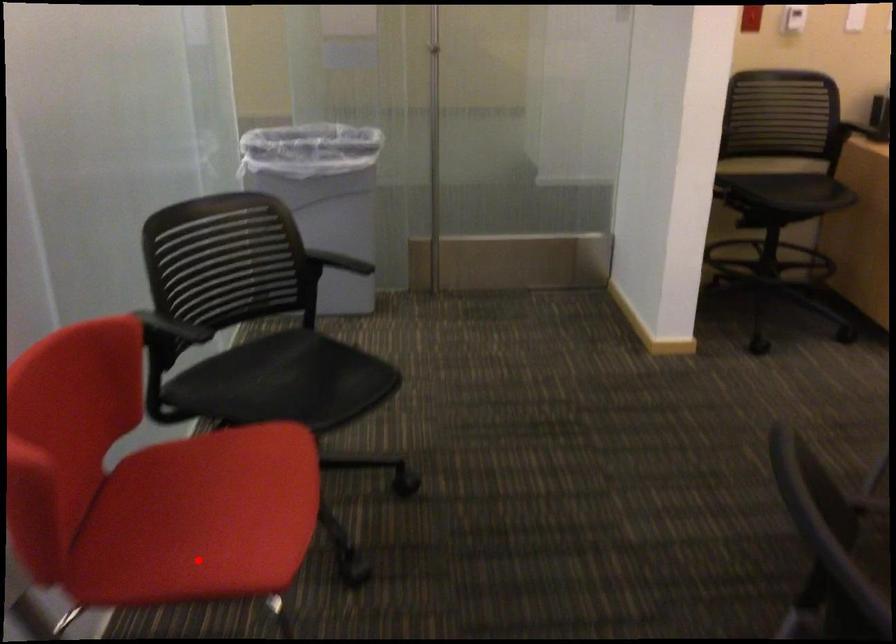
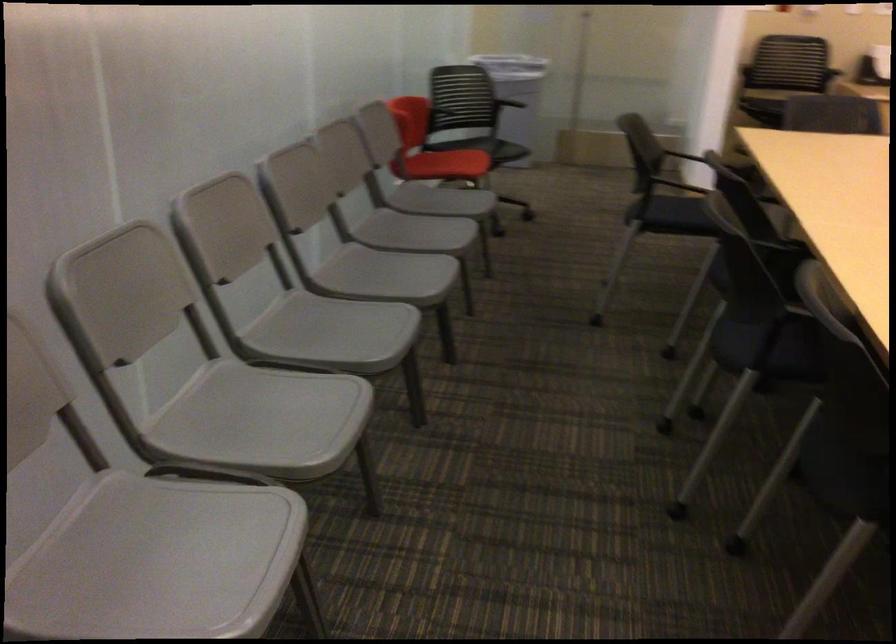
Find the pixel in the second image that matches the highlighted location in the first image.

(446, 164)